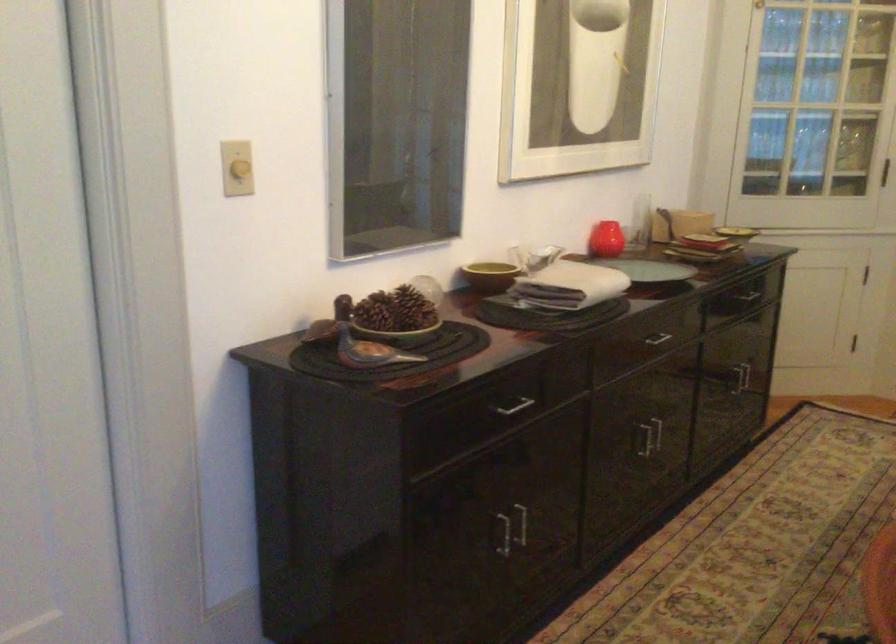
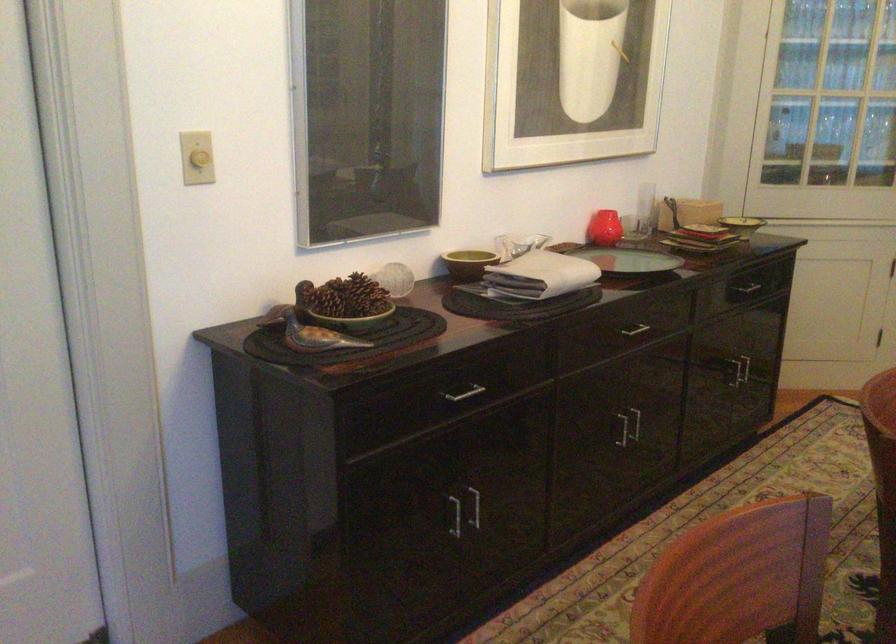
Where in the second image is the point corresponding to point 504,532 from the first image?

(453, 514)